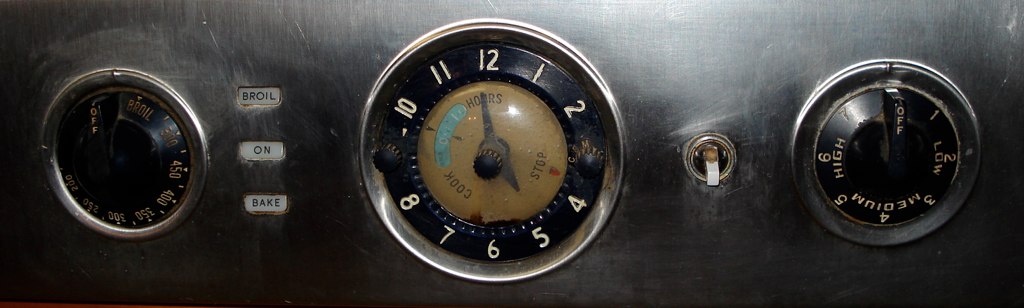
You are a GUI agent. You are given a task and a screenshot of the screen. Output one action in this format:
    pyautogui.click(x=<x>, y=<y>)
    Task: Click on the broil button
    
    Given the screenshot: What is the action you would take?
    pyautogui.click(x=258, y=98)